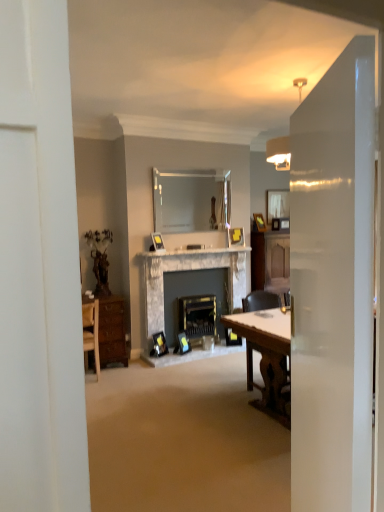
This screenshot has height=512, width=384. Describe the element at coordinates (277, 204) in the screenshot. I see `matte glass mirror at upper center, which is the 1th mirror in right-to-left order` at that location.

What is the approximate width of matte glass mirror at upper center, positioned as the first mirror in back-to-front order?

matte glass mirror at upper center, positioned as the first mirror in back-to-front order, is 2.40 inches wide.

Describe the element at coordinates (236, 236) in the screenshot. This screenshot has height=512, width=384. I see `matte yellow picture frame at center, which is the fourth picture frame from left to right` at that location.

This screenshot has height=512, width=384. Identify the location of marble fireplace at center, arranged as the first fireplace when viewed from the left. (188, 271).

Locate an element on the screen. This screenshot has width=384, height=512. wooden picture frame at center, positioned as the 5th picture frame in left-to-right order is located at coordinates (259, 222).

Identify the location of matte black picture frame at center, the 3th picture frame from the back. This screenshot has height=512, width=384. (183, 343).

From a real-world perspective, which is physically below, matte black picture frame at center, which is the third picture frame in left-to-right order, or matte yellow picture frame at center, the second picture frame when ordered from top to bottom?

matte black picture frame at center, which is the third picture frame in left-to-right order.

Is matte black picture frame at center, the second picture frame from the bottom, taller than matte yellow picture frame at center, the second picture frame in the back-to-front sequence?

Indeed, matte black picture frame at center, the second picture frame from the bottom, has a greater height compared to matte yellow picture frame at center, the second picture frame in the back-to-front sequence.

Which point is more distant from viewer, (184, 349) or (230, 241)?

The point (230, 241) is farther.

Is matte black picture frame at center, the 3th picture frame in the right-to-left sequence, to the right of matte yellow picture frame at center, which is the fourth picture frame from left to right, from the viewer's perspective?

In fact, matte black picture frame at center, the 3th picture frame in the right-to-left sequence, is to the left of matte yellow picture frame at center, which is the fourth picture frame from left to right.

From the picture: Looking at their sizes, would you say matte silver picture frame at center, the 3th picture frame from the bottom, is wider or thinner than transparent glass door at right?

Considering their sizes, matte silver picture frame at center, the 3th picture frame from the bottom, looks slimmer than transparent glass door at right.

Who is shorter, matte silver picture frame at center, which is the second picture frame from front to back, or transparent glass door at right?

matte silver picture frame at center, which is the second picture frame from front to back.

Which object is further away from the camera, matte silver picture frame at center, the fourth picture frame positioned from the back, or transparent glass door at right?

matte silver picture frame at center, the fourth picture frame positioned from the back, is behind.

Based on the photo, from a real-world perspective, relative to transparent glass door at right, is matte silver picture frame at center, the 3th picture frame from the bottom, vertically above or below?

From a real-world perspective, matte silver picture frame at center, the 3th picture frame from the bottom, is physically above transparent glass door at right.

What's the angular difference between wooden picture frame at center, arranged as the fifth picture frame when viewed from the front, and clear glass mirror at upper center, which appears as the first mirror when viewed from the left,'s facing directions?

20.2 degrees.

Considering the relative sizes of wooden picture frame at center, which is the 5th picture frame from bottom to top, and clear glass mirror at upper center, positioned as the 2th mirror in back-to-front order, in the image provided, is wooden picture frame at center, which is the 5th picture frame from bottom to top, shorter than clear glass mirror at upper center, positioned as the 2th mirror in back-to-front order,?

Yes, wooden picture frame at center, which is the 5th picture frame from bottom to top, is shorter than clear glass mirror at upper center, positioned as the 2th mirror in back-to-front order.

Considering the positions of objects wooden picture frame at center, positioned as the 5th picture frame in left-to-right order, and clear glass mirror at upper center, positioned as the 2th mirror in back-to-front order, in the image provided, who is more to the left, wooden picture frame at center, positioned as the 5th picture frame in left-to-right order, or clear glass mirror at upper center, positioned as the 2th mirror in back-to-front order,?

Positioned to the left is clear glass mirror at upper center, positioned as the 2th mirror in back-to-front order.

Is wooden picture frame at center, arranged as the fifth picture frame when viewed from the front, positioned behind clear glass mirror at upper center, which is counted as the second mirror, starting from the right?

Yes, the depth of wooden picture frame at center, arranged as the fifth picture frame when viewed from the front, is greater than that of clear glass mirror at upper center, which is counted as the second mirror, starting from the right.

In the image, is wooden picture frame at center, arranged as the 1th picture frame when viewed from the top, on the left side or the right side of wooden table at right?

wooden picture frame at center, arranged as the 1th picture frame when viewed from the top, is to the right of wooden table at right.

From the image's perspective, which one is positioned higher, wooden picture frame at center, arranged as the fifth picture frame when viewed from the front, or wooden table at right?

From the image's view, wooden picture frame at center, arranged as the fifth picture frame when viewed from the front, is above.

From a real-world perspective, which is physically above, wooden picture frame at center, positioned as the 1th picture frame in right-to-left order, or wooden table at right?

wooden picture frame at center, positioned as the 1th picture frame in right-to-left order.

In terms of size, does wooden picture frame at center, which is the 5th picture frame from bottom to top, appear bigger or smaller than wooden table at right?

wooden picture frame at center, which is the 5th picture frame from bottom to top, is smaller than wooden table at right.

Between matte black picture frame at center, acting as the 1th picture frame starting from the front, and wooden picture frame at center, positioned as the 5th picture frame in left-to-right order, which one has less height?

wooden picture frame at center, positioned as the 5th picture frame in left-to-right order, is shorter.

Is matte black picture frame at center, acting as the 1th picture frame starting from the front, next to wooden picture frame at center, which is the 5th picture frame from bottom to top?

matte black picture frame at center, acting as the 1th picture frame starting from the front, is not next to wooden picture frame at center, which is the 5th picture frame from bottom to top, and they're not touching.

Considering the relative sizes of matte black picture frame at center, which is the 5th picture frame in back-to-front order, and wooden picture frame at center, which is the 5th picture frame from bottom to top, in the image provided, is matte black picture frame at center, which is the 5th picture frame in back-to-front order, thinner than wooden picture frame at center, which is the 5th picture frame from bottom to top,?

Incorrect, the width of matte black picture frame at center, which is the 5th picture frame in back-to-front order, is not less than that of wooden picture frame at center, which is the 5th picture frame from bottom to top.

Where is `the 4th picture frame below the wooden picture frame at center, marked as the first picture frame in a back-to-front arrangement (from the image's perspective)`? Image resolution: width=384 pixels, height=512 pixels. the 4th picture frame below the wooden picture frame at center, marked as the first picture frame in a back-to-front arrangement (from the image's perspective) is located at coordinates (160, 344).

Between transparent glass door at right and matte glass mirror at upper center, which is the 1th mirror in right-to-left order, which one has smaller width?

matte glass mirror at upper center, which is the 1th mirror in right-to-left order, is thinner.

Is transparent glass door at right not within matte glass mirror at upper center, the second mirror in the front-to-back sequence?

transparent glass door at right lies outside matte glass mirror at upper center, the second mirror in the front-to-back sequence,'s area.

What's the angular difference between transparent glass door at right and matte glass mirror at upper center, which is the 1th mirror in right-to-left order,'s facing directions?

There is a 120-degree angle between the facing directions of transparent glass door at right and matte glass mirror at upper center, which is the 1th mirror in right-to-left order.

Which is closer, (303, 255) or (275, 207)?

Positioned in front is point (303, 255).

Can you confirm if white marble fireplace at center is smaller than matte yellow picture frame at center, which is the second picture frame from right to left?

No, white marble fireplace at center is not smaller than matte yellow picture frame at center, which is the second picture frame from right to left.

Considering the relative sizes of white marble fireplace at center and matte yellow picture frame at center, the second picture frame in the back-to-front sequence, in the image provided, is white marble fireplace at center shorter than matte yellow picture frame at center, the second picture frame in the back-to-front sequence,?

Indeed, white marble fireplace at center has a lesser height compared to matte yellow picture frame at center, the second picture frame in the back-to-front sequence.

From a real-world perspective, does white marble fireplace at center stand above matte yellow picture frame at center, the second picture frame in the back-to-front sequence?

No, from a real-world perspective, white marble fireplace at center is not above matte yellow picture frame at center, the second picture frame in the back-to-front sequence.

Is white marble fireplace at center located outside matte yellow picture frame at center, the second picture frame in the back-to-front sequence?

white marble fireplace at center is positioned outside matte yellow picture frame at center, the second picture frame in the back-to-front sequence.

Identify the location of picture frame that is the 2nd one when counting upward from the matte black picture frame at center, which is the third picture frame in left-to-right order (from the image's perspective). (236, 236).

The height and width of the screenshot is (512, 384). I want to click on glass door below the matte silver picture frame at center, the fourth picture frame positioned from the back (from a real-world perspective), so click(333, 286).

Which object lies further to the anchor point matte black picture frame at center, marked as the third picture frame in a front-to-back arrangement, wooden picture frame at center, positioned as the 5th picture frame in left-to-right order, or matte black fireplace at center, acting as the 2th fireplace starting from the left?

wooden picture frame at center, positioned as the 5th picture frame in left-to-right order, lies further to matte black picture frame at center, marked as the third picture frame in a front-to-back arrangement, than the other object.

Estimate the real-world distances between objects in this image. Which object is further from marble fireplace at center, arranged as the first fireplace when viewed from the left, wooden table at right or white marble fireplace at center?

Based on the image, wooden table at right appears to be further to marble fireplace at center, arranged as the first fireplace when viewed from the left.

Looking at the image, which one is located closer to matte black picture frame at center, marked as the 2th picture frame in a left-to-right arrangement, white marble fireplace at center or marble fireplace at center, arranged as the first fireplace when viewed from the left?

Among the two, marble fireplace at center, arranged as the first fireplace when viewed from the left, is located nearer to matte black picture frame at center, marked as the 2th picture frame in a left-to-right arrangement.

Which object lies further to the anchor point clear glass mirror at upper center, positioned as the 2th mirror in back-to-front order, matte glass mirror at upper center, arranged as the second mirror when viewed from the left, or matte yellow picture frame at center, which is the fourth picture frame from left to right?

matte glass mirror at upper center, arranged as the second mirror when viewed from the left, is further to clear glass mirror at upper center, positioned as the 2th mirror in back-to-front order.

From the image, which object appears to be nearer to wooden table at right, matte glass mirror at upper center, arranged as the second mirror when viewed from the left, or white marble fireplace at center?

white marble fireplace at center is positioned closer to the anchor wooden table at right.

Considering their positions, is matte glass mirror at upper center, the second mirror in the front-to-back sequence, positioned closer to matte black fireplace at center, which is counted as the 1th fireplace, starting from the right, than wooden picture frame at center, positioned as the 1th picture frame in right-to-left order?

Based on the image, wooden picture frame at center, positioned as the 1th picture frame in right-to-left order, appears to be nearer to matte black fireplace at center, which is counted as the 1th fireplace, starting from the right.

When comparing their distances from matte yellow picture frame at center, the second picture frame in the back-to-front sequence, does matte black picture frame at center, which is the 5th picture frame in back-to-front order, or transparent glass door at right seem closer?

matte black picture frame at center, which is the 5th picture frame in back-to-front order.

From the image, which object appears to be farther from white marble fireplace at center, wooden chair at right or matte black picture frame at center, the 3th picture frame in the right-to-left sequence?

The object further to white marble fireplace at center is wooden chair at right.

This screenshot has width=384, height=512. I want to click on picture frame situated between clear glass mirror at upper center, positioned as the 2th mirror in back-to-front order, and wooden picture frame at center, arranged as the fifth picture frame when viewed from the front, from left to right, so click(236, 236).

The width and height of the screenshot is (384, 512). I want to click on mantle between transparent glass door at right and matte glass mirror at upper center, which is the 1th mirror in right-to-left order, along the z-axis, so click(x=195, y=251).

Where is `mantle between matte silver picture frame at center, the 3th picture frame from the bottom, and marble fireplace at center, arranged as the first fireplace when viewed from the left, in the vertical direction`? Image resolution: width=384 pixels, height=512 pixels. mantle between matte silver picture frame at center, the 3th picture frame from the bottom, and marble fireplace at center, arranged as the first fireplace when viewed from the left, in the vertical direction is located at coordinates (195, 251).

I want to click on mantle located between transparent glass door at right and matte black fireplace at center, which is counted as the 1th fireplace, starting from the right, in the depth direction, so click(x=195, y=251).